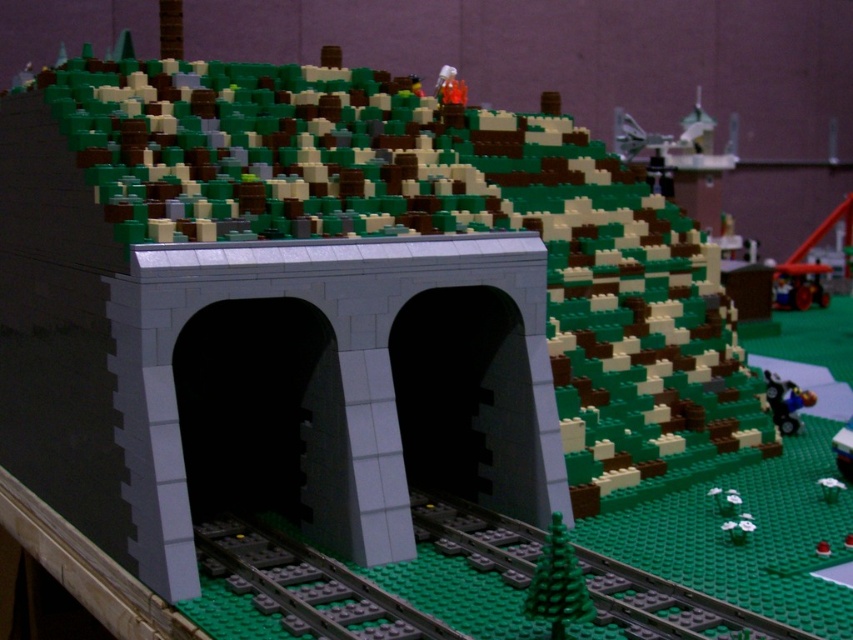
Is green plastic train track at lower center shorter than gray metallic train track at lower center?

No.

Can you confirm if green plastic train track at lower center is smaller than gray metallic train track at lower center?

Actually, green plastic train track at lower center might be larger than gray metallic train track at lower center.

Measure the distance between green plastic train track at lower center and camera.

A distance of 1.22 meters exists between green plastic train track at lower center and camera.

At what (x,y) coordinates should I click in order to perform the action: click on green plastic train track at lower center. Please return your answer as a coordinate pair (x, y). The width and height of the screenshot is (853, 640). Looking at the image, I should click on [x=666, y=605].